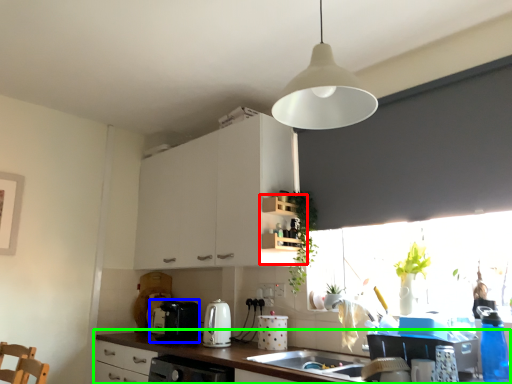
Question: Which object is the farthest from shelf (highlighted by a red box)? Choose among these: appliance (highlighted by a blue box) or countertop (highlighted by a green box).

Choices:
 (A) appliance
 (B) countertop

Answer: (A)